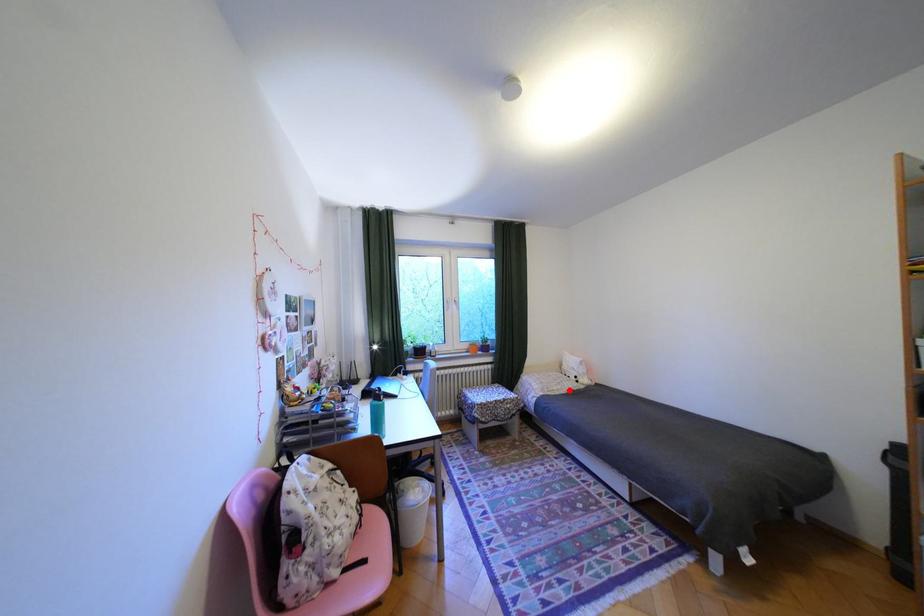
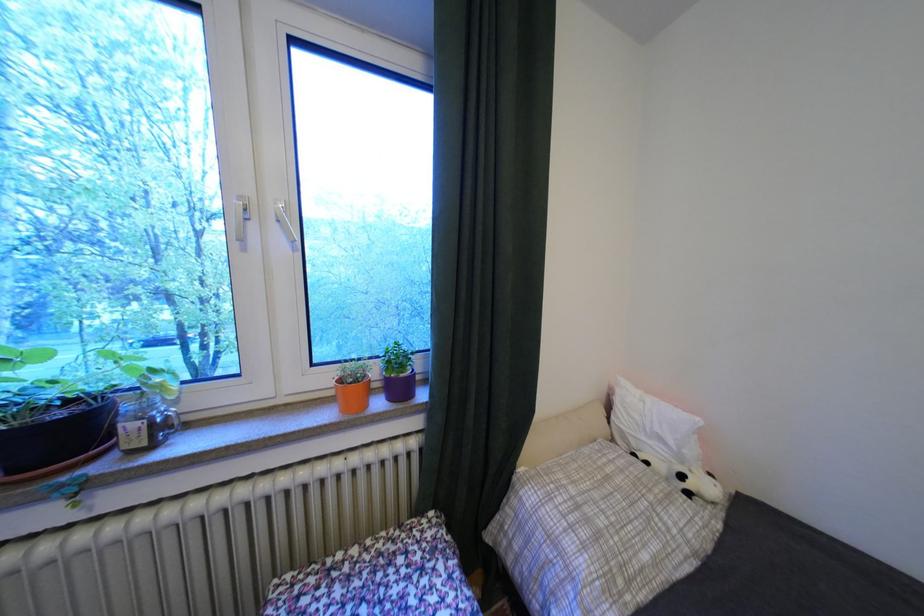
Locate, in the second image, the point that corresponds to the highlighted location in the first image.

(667, 562)